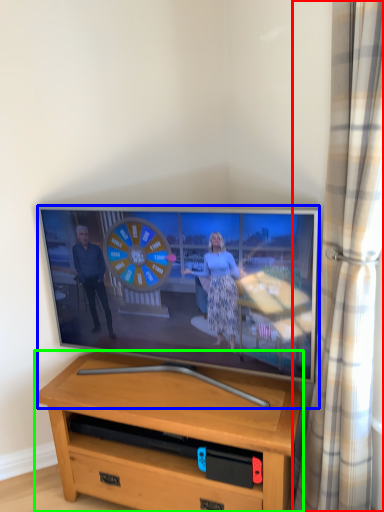
Question: Based on their relative distances, which object is farther from curtain (highlighted by a red box)? Choose from television (highlighted by a blue box) and desk (highlighted by a green box).

Choices:
 (A) television
 (B) desk

Answer: (B)